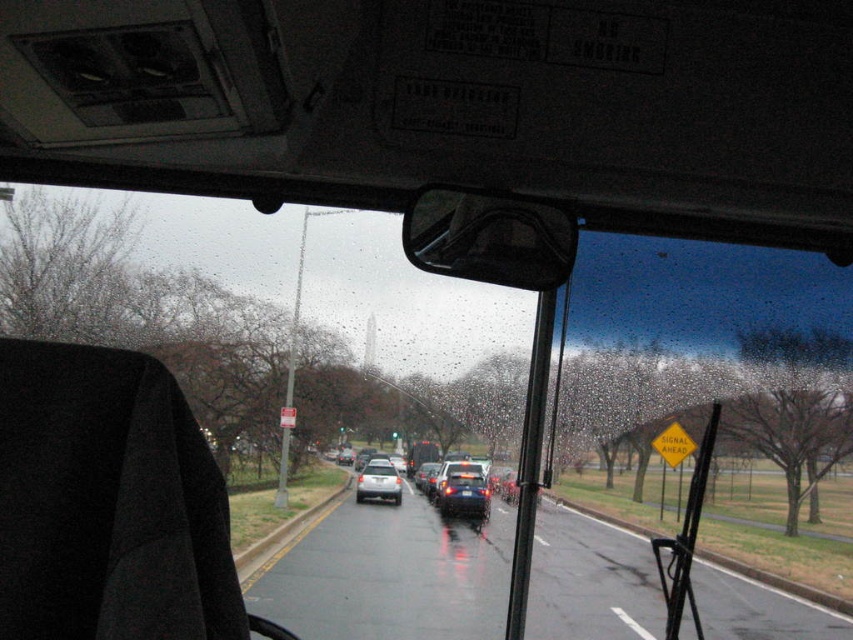
You are a passenger on the metallic silver bus at center and want to know if the shiny blue sedan at center in front of you is wider than your bus. Can you determine this based on the scene?

The shiny blue sedan at center might be wider than metallic silver bus at center, so there is a possibility that the shiny blue sedan at center is wider than the metallic silver bus at center.

You are a passenger in the metallic silver bus at center and want to know if you can safely reach the matte black sedan at center to retrieve your forgotten bag. The arm can extend 18 inches. Can you reach it?

The distance between the matte black sedan at center and metallic silver bus at center is 20.83 inches. Since your arm can only extend 18 inches, you cannot safely reach the matte black sedan at center.

You are a passenger on the bus and want to know if the matte black sedan at center is larger than the metallic silver bus at center. Based on the scene, can you determine which vehicle is bigger?

The matte black sedan at center is bigger than the metallic silver bus at center according to the description.